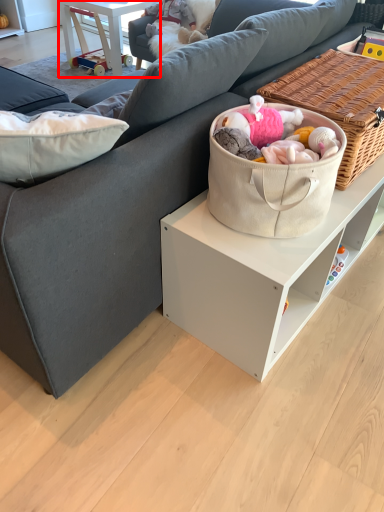
Question: From the image's perspective, where is table (annotated by the red box) located relative to picnic basket?

Choices:
 (A) above
 (B) below

Answer: (A)